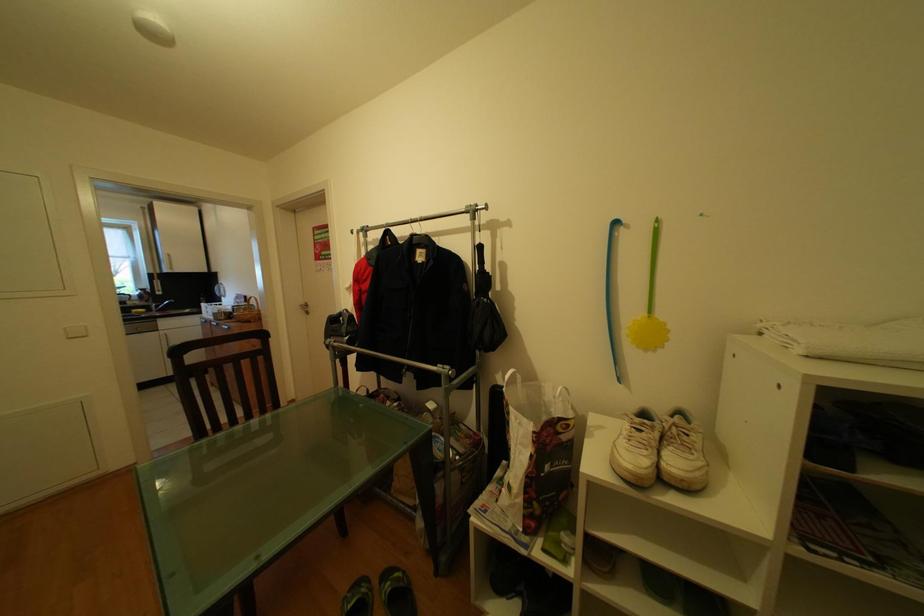
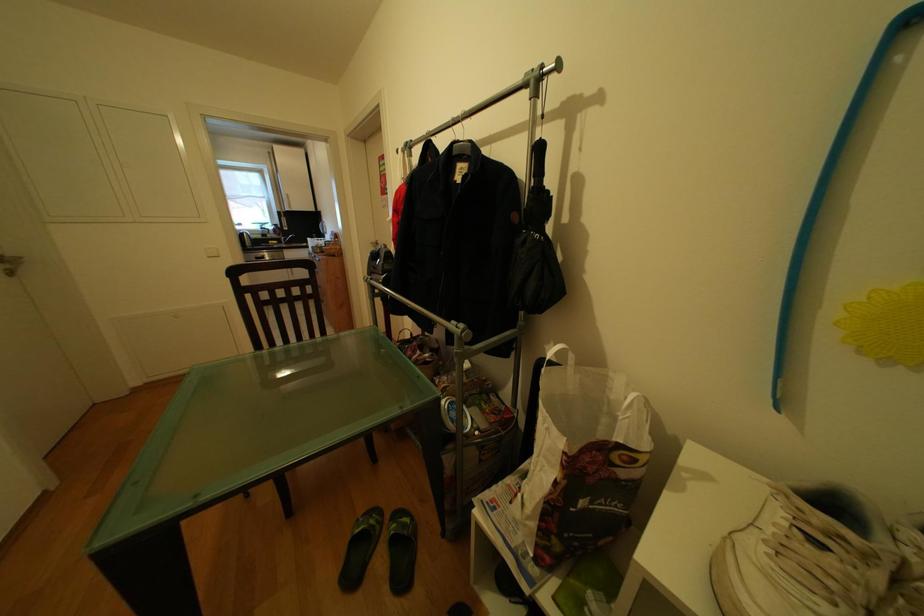
Question: How did the camera likely rotate?

Choices:
 (A) Left
 (B) Right
 (C) Up
 (D) Down

Answer: (A)